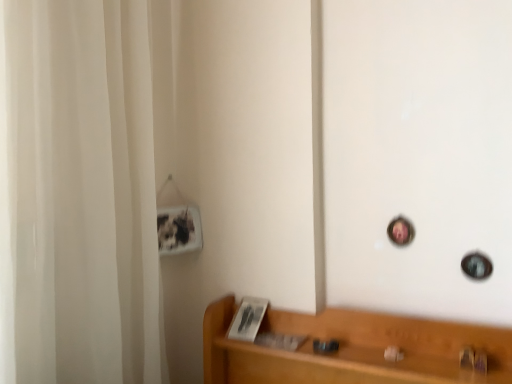
Question: Does white fabric shower curtain at left come behind light brown wood shelf at lower right?

Choices:
 (A) no
 (B) yes

Answer: (A)

Question: Is white fabric shower curtain at left oriented towards light brown wood shelf at lower right?

Choices:
 (A) yes
 (B) no

Answer: (A)

Question: From a real-world perspective, is white fabric shower curtain at left over light brown wood shelf at lower right?

Choices:
 (A) no
 (B) yes

Answer: (B)

Question: Can you confirm if white fabric shower curtain at left is thinner than light brown wood shelf at lower right?

Choices:
 (A) yes
 (B) no

Answer: (B)

Question: Is white fabric shower curtain at left bigger than light brown wood shelf at lower right?

Choices:
 (A) yes
 (B) no

Answer: (A)

Question: In terms of height, does metallic gold door handle at lower right look taller or shorter compared to light brown wood shelf at lower right?

Choices:
 (A) tall
 (B) short

Answer: (B)

Question: From the image's perspective, is metallic gold door handle at lower right above or below light brown wood shelf at lower right?

Choices:
 (A) above
 (B) below

Answer: (A)

Question: From a real-world perspective, is metallic gold door handle at lower right above or below light brown wood shelf at lower right?

Choices:
 (A) below
 (B) above

Answer: (B)

Question: Is point [x=480, y=355] positioned closer to the camera than point [x=202, y=349]?

Choices:
 (A) farther
 (B) closer

Answer: (B)

Question: From their relative heights in the image, would you say light brown wood shelf at lower right is taller or shorter than white fabric shower curtain at left?

Choices:
 (A) tall
 (B) short

Answer: (B)

Question: From a real-world perspective, is light brown wood shelf at lower right above or below white fabric shower curtain at left?

Choices:
 (A) below
 (B) above

Answer: (A)

Question: Considering the positions of point pyautogui.click(x=474, y=372) and point pyautogui.click(x=117, y=185), is point pyautogui.click(x=474, y=372) closer or farther from the camera than point pyautogui.click(x=117, y=185)?

Choices:
 (A) farther
 (B) closer

Answer: (B)

Question: Is light brown wood shelf at lower right to the left or to the right of white fabric shower curtain at left in the image?

Choices:
 (A) right
 (B) left

Answer: (A)

Question: Relative to light brown wood shelf at lower right, is white fabric shower curtain at left in front or behind?

Choices:
 (A) front
 (B) behind

Answer: (A)

Question: Is white fabric shower curtain at left taller or shorter than light brown wood shelf at lower right?

Choices:
 (A) tall
 (B) short

Answer: (A)